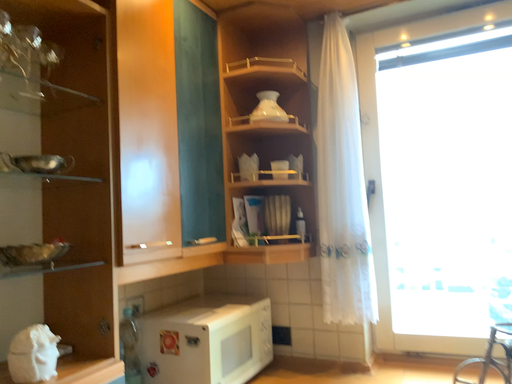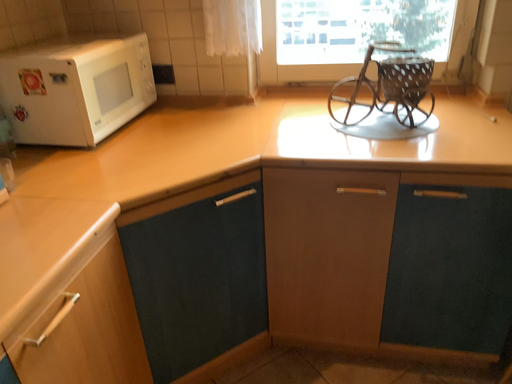
Question: How did the camera likely rotate when shooting the video?

Choices:
 (A) rotated left
 (B) rotated right

Answer: (B)